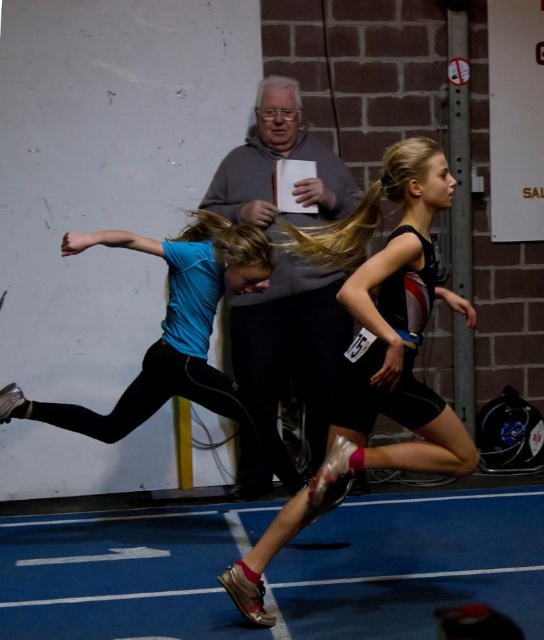
Does point (428, 147) come behind point (183, 396)?

No, it is in front of (183, 396).

At what (x,y) coordinates should I click in order to perform the action: click on black matte running suit at center. Please return your answer as a coordinate pair (x, y). This screenshot has width=544, height=640. Looking at the image, I should click on (374, 353).

Can you confirm if black matte running suit at center is taller than gray matte jacket at center?

No.

Who is more forward, (355, 241) or (322, 433)?

Point (355, 241) is in front.

The image size is (544, 640). Identify the location of black matte running suit at center. (374, 353).

Who is more forward, (299, 314) or (169, 321)?

Positioned in front is point (169, 321).

Locate an element on the screen. This screenshot has width=544, height=640. gray matte jacket at center is located at coordinates (290, 340).